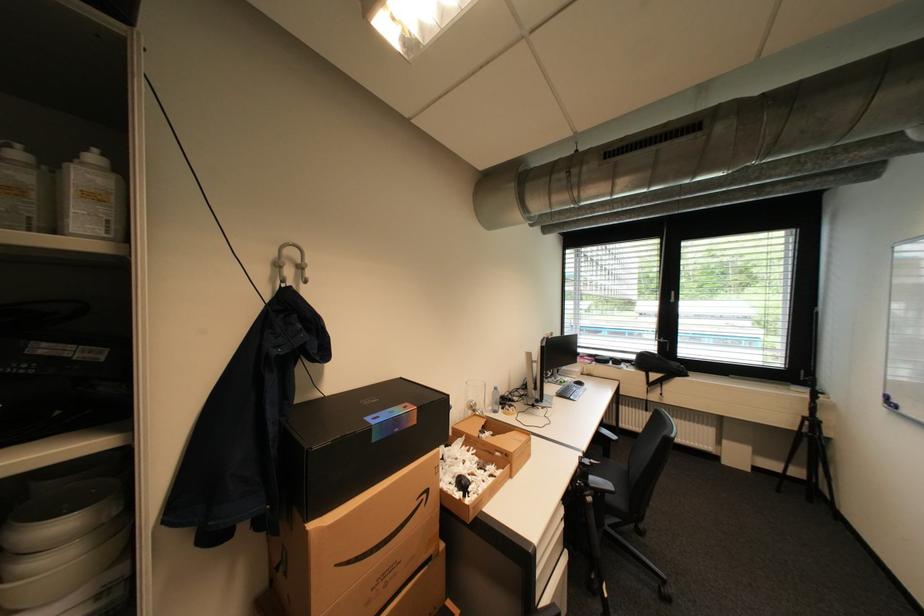
Where is `chair armrest`? This screenshot has width=924, height=616. chair armrest is located at coordinates (602, 485).